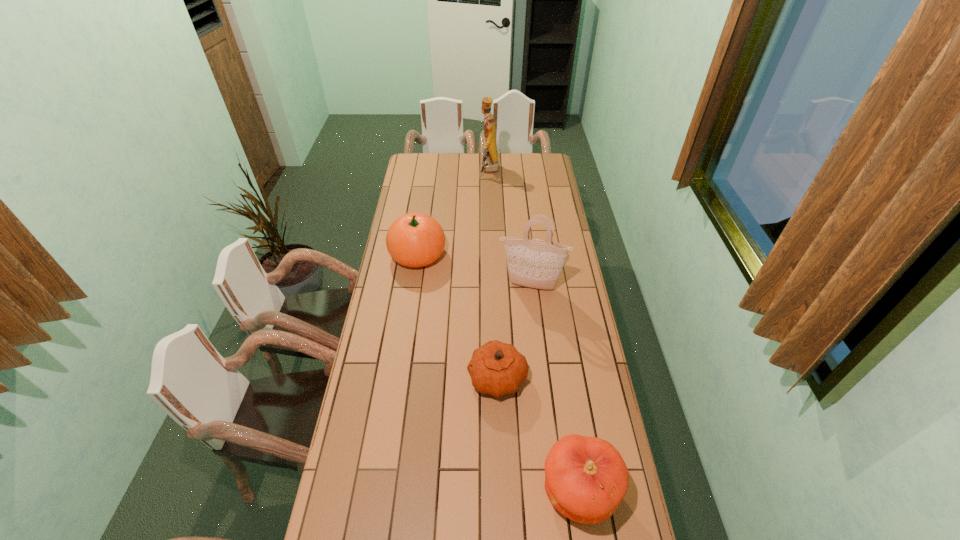
Where is `pumpkin that is at the right edge`? The height and width of the screenshot is (540, 960). pumpkin that is at the right edge is located at coordinates (586, 478).

Where is `vacant space at the far edge of the desktop`? This screenshot has height=540, width=960. vacant space at the far edge of the desktop is located at coordinates (471, 164).

The width and height of the screenshot is (960, 540). What are the coordinates of `vacant position at the left edge of the desktop` in the screenshot? It's located at (347, 495).

This screenshot has height=540, width=960. In the image, there is a desktop. Identify the location of vacant space at the right edge. (562, 214).

Where is `vacant region at the far left corner of the desktop`? This screenshot has height=540, width=960. vacant region at the far left corner of the desktop is located at coordinates (420, 163).

The height and width of the screenshot is (540, 960). Identify the location of vacant area at the far right corner. (534, 172).

You are a GUI agent. You are given a task and a screenshot of the screen. Output one action in this format:
    pyautogui.click(x=<x>, y=<y>)
    Task: Click on the free point between the shortest object and the nutcracker
    The height and width of the screenshot is (540, 960).
    Given the screenshot: What is the action you would take?
    pyautogui.click(x=493, y=274)

I want to click on free space between the second pumpkin from left to right and the nutcracker, so click(493, 274).

Find the location of `the closest object relative to the shortest pumpkin`. the closest object relative to the shortest pumpkin is located at coordinates pos(586,478).

Where is `the third closest object to the nearest pumpkin`? This screenshot has width=960, height=540. the third closest object to the nearest pumpkin is located at coordinates (415, 239).